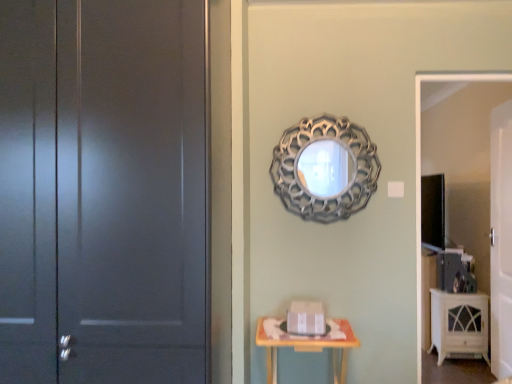
Question: From their relative heights in the image, would you say wooden table at lower center is taller or shorter than white glossy door at right, which is the 2th door from left to right?

Choices:
 (A) tall
 (B) short

Answer: (B)

Question: Is wooden table at lower center bigger or smaller than white glossy door at right, the second door from the front?

Choices:
 (A) small
 (B) big

Answer: (A)

Question: Estimate the real-world distances between objects in this image. Which object is farther from the silver metallic mirror at upper center?

Choices:
 (A) white glossy cabinet at lower right
 (B) matte gray door at left, the second door in the back-to-front sequence
 (C) wooden table at lower center
 (D) white glossy door at right, which is the first door in right-to-left order
 (E) white glossy tv stand at right

Answer: (A)

Question: Which is farther from the matte gray door at left, the second door in the back-to-front sequence?

Choices:
 (A) wooden table at lower center
 (B) white glossy tv stand at right
 (C) white glossy door at right, the second door from the front
 (D) silver metallic mirror at upper center
 (E) white glossy cabinet at lower right

Answer: (E)